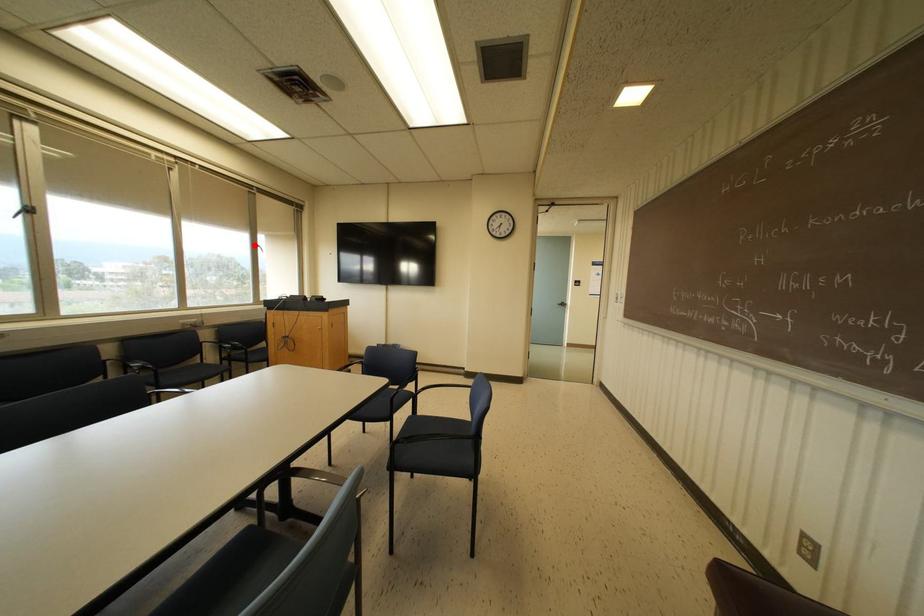
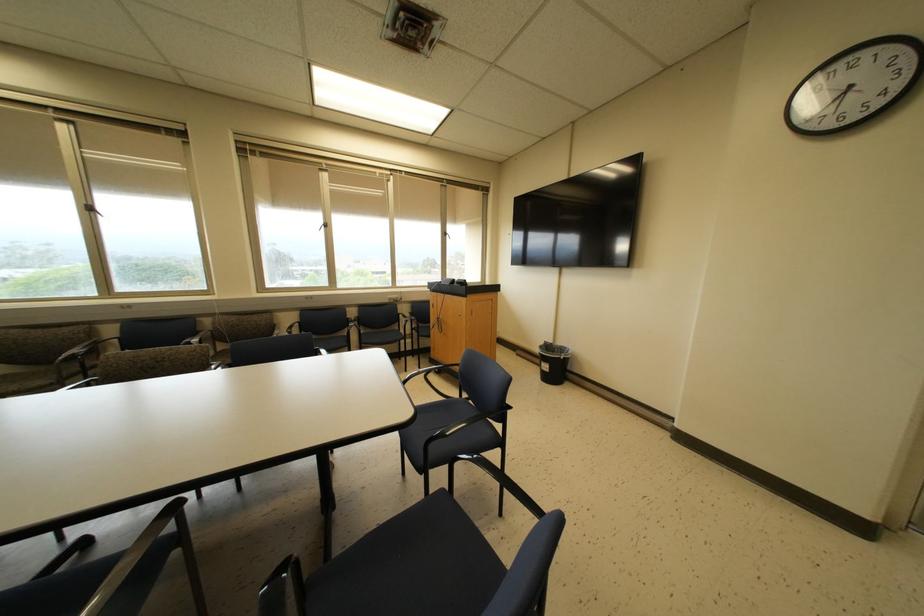
Question: I am providing you with two images of the same scene from different viewpoints. Image1 has a red point marked. In image2, the corresponding 3D location appears at what relative position? Reply with the corresponding letter.

Choices:
 (A) Closer
 (B) Farther

Answer: (A)